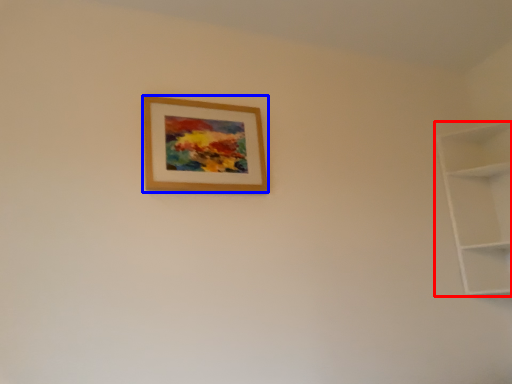
Question: Which of the following is the farthest to the observer, shelf (highlighted by a red box) or picture frame (highlighted by a blue box)?

Choices:
 (A) shelf
 (B) picture frame

Answer: (A)